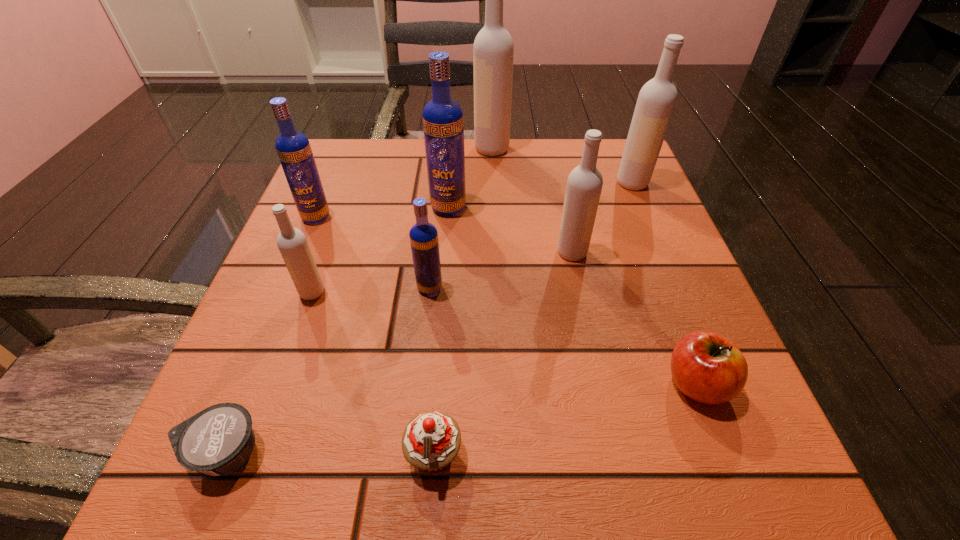
Find the location of `the leftmost white vodka`. the leftmost white vodka is located at coordinates (292, 243).

The image size is (960, 540). I want to click on cupcake, so click(x=431, y=440).

I want to click on the eighth farthest object, so click(707, 367).

The height and width of the screenshot is (540, 960). Identify the location of apple. (707, 367).

You are a GUI agent. You are given a task and a screenshot of the screen. Output one action in this format:
    pyautogui.click(x=<x>, y=<y>)
    Task: Click on the shortest object
    The width and height of the screenshot is (960, 540).
    Given the screenshot: What is the action you would take?
    pyautogui.click(x=219, y=439)

Where is `free space located 0.300m on the front of the tallest object`? The height and width of the screenshot is (540, 960). free space located 0.300m on the front of the tallest object is located at coordinates (x=495, y=242).

Where is `free region located 0.120m on the back of the second farthest vodka`? This screenshot has height=540, width=960. free region located 0.120m on the back of the second farthest vodka is located at coordinates (617, 146).

Locate an element on the screen. This screenshot has height=540, width=960. vacant area located on the front of the biggest blue vodka is located at coordinates (438, 342).

Identify the location of free region located 0.360m on the front of the leftmost blue vodka. (244, 390).

Identify the location of free space located on the back of the sixth nearest object. (564, 213).